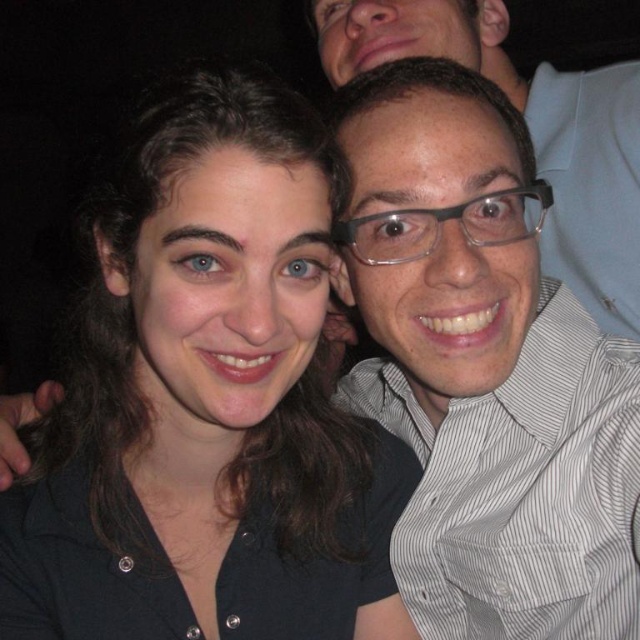
Is white striped shirt at center shorter than clear plastic glasses at upper right?

Indeed, white striped shirt at center has a lesser height compared to clear plastic glasses at upper right.

Does white striped shirt at center lie behind clear plastic glasses at upper right?

No, white striped shirt at center is closer to the viewer.

Between point (499, 417) and point (592, 292), which one is positioned in front?

Positioned in front is point (499, 417).

Identify the location of white striped shirt at center. The width and height of the screenshot is (640, 640). 522,488.

Consider the image. Can you confirm if black matte shirt at center is shorter than white striped shirt at center?

No.

Can you confirm if black matte shirt at center is positioned below white striped shirt at center?

Actually, black matte shirt at center is above white striped shirt at center.

Between point (301, 524) and point (602, 413), which one is positioned in front?

Point (602, 413)

This screenshot has width=640, height=640. I want to click on black matte shirt at center, so click(x=208, y=403).

Looking at this image, is black matte shirt at center wider than clear plastic glasses at upper right?

In fact, black matte shirt at center might be narrower than clear plastic glasses at upper right.

Which is behind, point (19, 529) or point (637, 124)?

The point (637, 124) is more distant.

This screenshot has width=640, height=640. I want to click on black matte shirt at center, so click(208, 403).